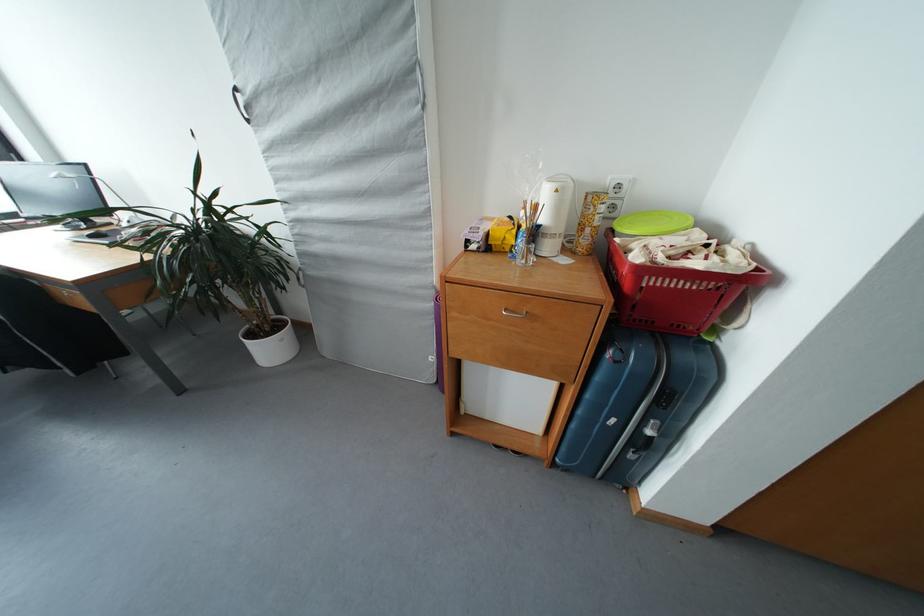
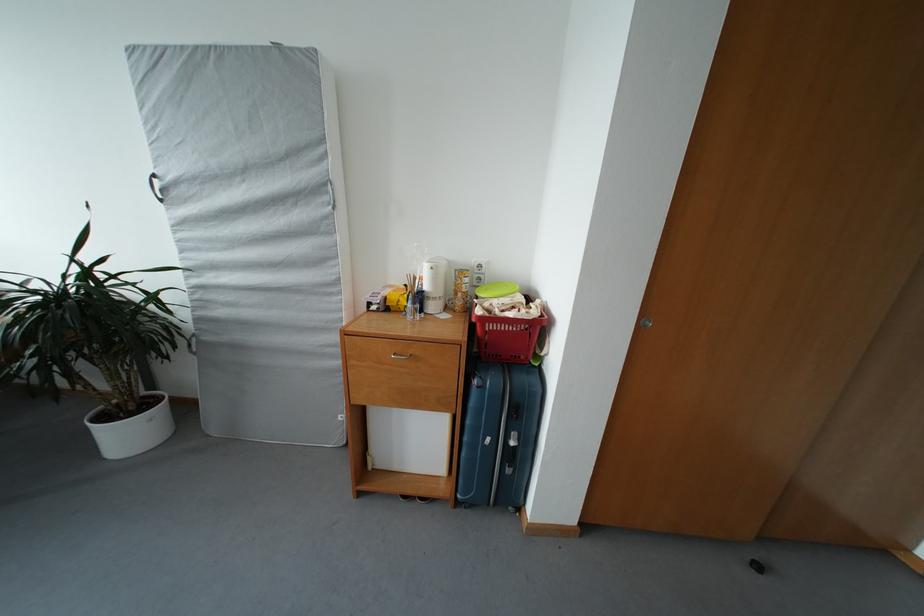
The point at (560,241) is marked in the first image. Where is the corresponding point in the second image?

(441, 304)